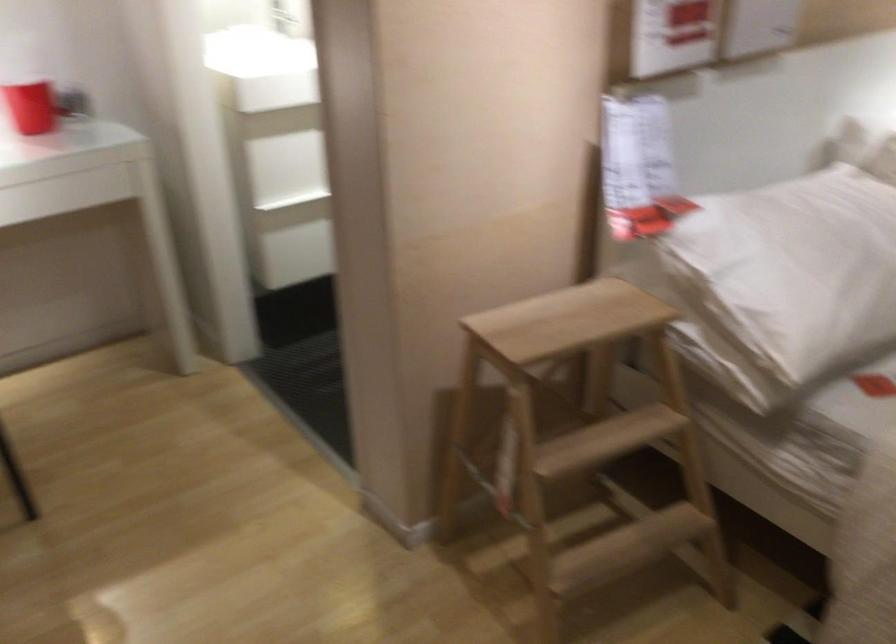
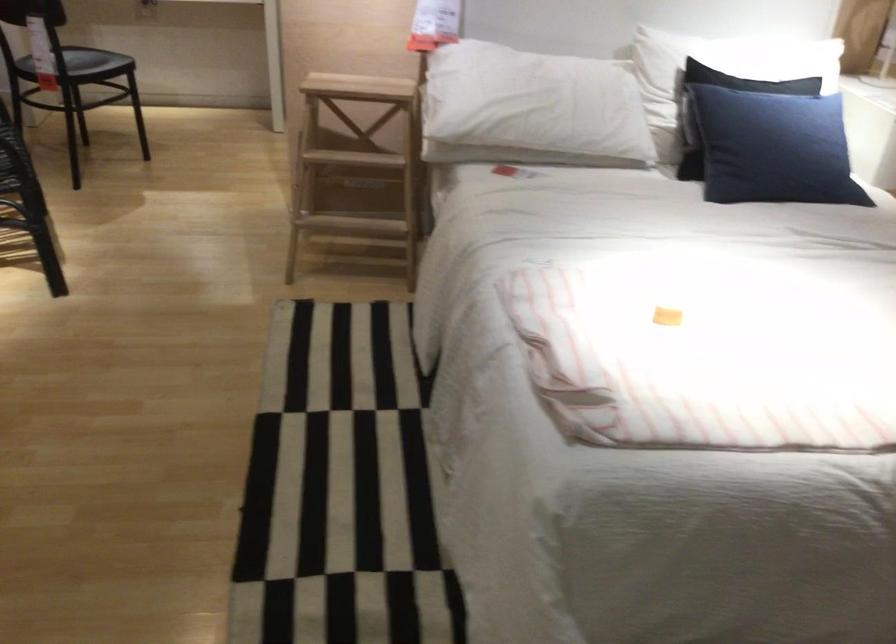
Where in the second image is the point corresponding to [605,453] from the first image?

(357, 164)